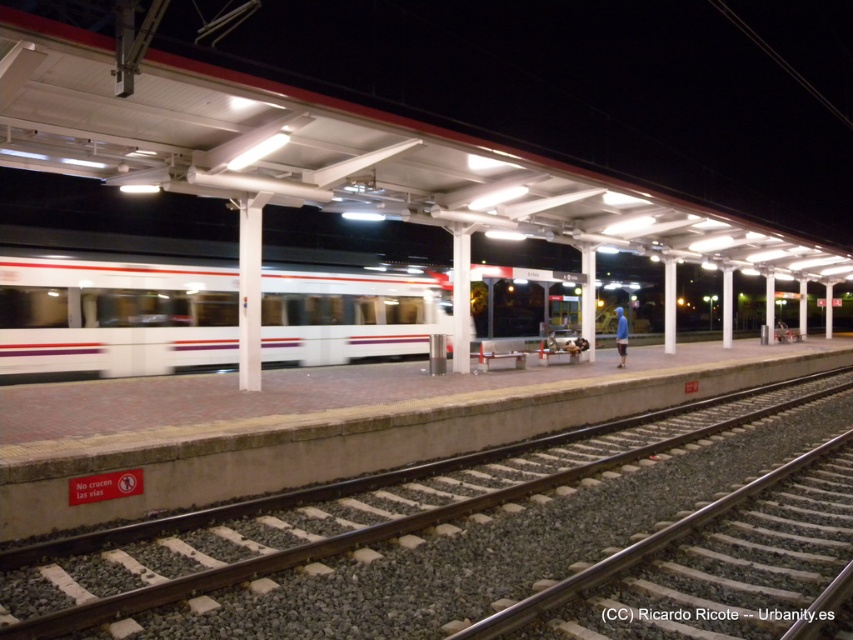
Looking at this image, does brown gravel track at lower center lie in front of white glossy train at center?

Yes, brown gravel track at lower center is in front of white glossy train at center.

Between brown gravel track at lower center and white glossy train at center, which one is positioned lower?

brown gravel track at lower center is lower down.

Is point (427, 509) closer to viewer compared to point (311, 348)?

Yes, point (427, 509) is closer to viewer.

Image resolution: width=853 pixels, height=640 pixels. Identify the location of brown gravel track at lower center. (344, 513).

From the picture: Is brown gravel track at lower center to the right of smooth steel tracks at center from the viewer's perspective?

Yes, brown gravel track at lower center is to the right of smooth steel tracks at center.

Does brown gravel track at lower center have a greater height compared to smooth steel tracks at center?

Yes.

Measure the distance between point (49,568) and camera.

The distance of point (49,568) from camera is 5.93 meters.

At what (x,y) coordinates should I click in order to perform the action: click on brown gravel track at lower center. Please return your answer as a coordinate pair (x, y). The height and width of the screenshot is (640, 853). Looking at the image, I should click on (344, 513).

Can you confirm if white glossy train at center is positioned below smooth steel tracks at center?

Incorrect, white glossy train at center is not positioned below smooth steel tracks at center.

Does white glossy train at center have a greater width compared to smooth steel tracks at center?

Yes, white glossy train at center is wider than smooth steel tracks at center.

Where is `white glossy train at center`? This screenshot has height=640, width=853. white glossy train at center is located at coordinates (113, 305).